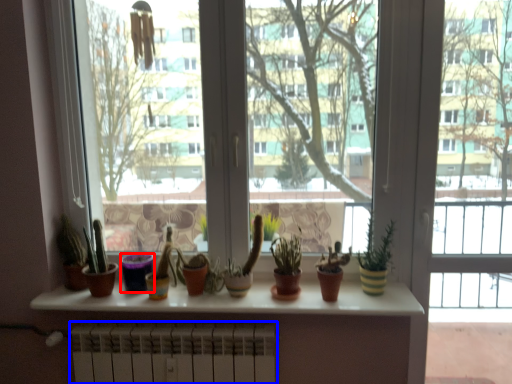
Question: Which of the following is the farthest to the observer, flowerpot (highlighted by a red box) or radiator (highlighted by a blue box)?

Choices:
 (A) flowerpot
 (B) radiator

Answer: (A)